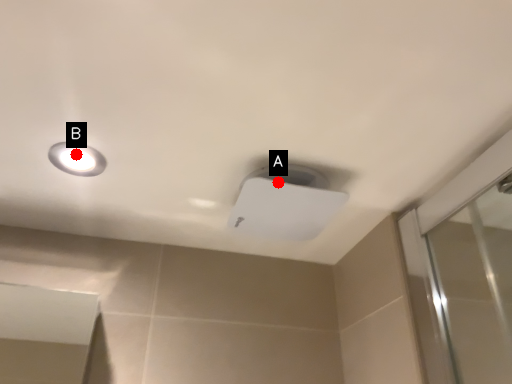
Question: Two points are circled on the image, labeled by A and B beside each circle. Which point is further to the camera?

Choices:
 (A) A is further
 (B) B is further

Answer: (B)